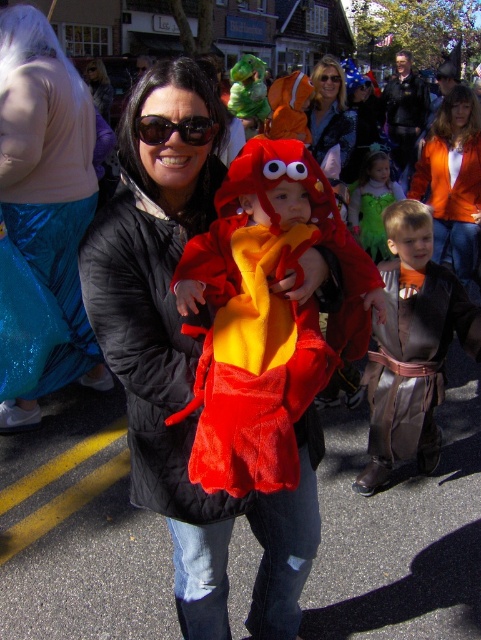
Which of these two, shiny teal skirt at lower left or brown leather armor at lower right, stands taller?

shiny teal skirt at lower left is taller.

Can you confirm if shiny teal skirt at lower left is wider than brown leather armor at lower right?

Indeed, shiny teal skirt at lower left has a greater width compared to brown leather armor at lower right.

What do you see at coordinates (42, 220) in the screenshot? Image resolution: width=481 pixels, height=640 pixels. I see `shiny teal skirt at lower left` at bounding box center [42, 220].

Find the location of a particular element. The width and height of the screenshot is (481, 640). shiny teal skirt at lower left is located at coordinates (42, 220).

This screenshot has width=481, height=640. What do you see at coordinates (412, 348) in the screenshot?
I see `brown leather armor at lower right` at bounding box center [412, 348].

Who is taller, brown leather armor at lower right or sunglassesmaterial/texture at upper center?

sunglassesmaterial/texture at upper center is taller.

The width and height of the screenshot is (481, 640). What do you see at coordinates (412, 348) in the screenshot?
I see `brown leather armor at lower right` at bounding box center [412, 348].

This screenshot has width=481, height=640. In order to click on brown leather armor at lower right in this screenshot , I will do `click(412, 348)`.

Is point (72, 380) behind point (352, 189)?

No, it is not.

Measure the distance between point (84, 179) and camera.

A distance of 3.76 meters exists between point (84, 179) and camera.

Where is `shiny teal skirt at lower left`? shiny teal skirt at lower left is located at coordinates (42, 220).